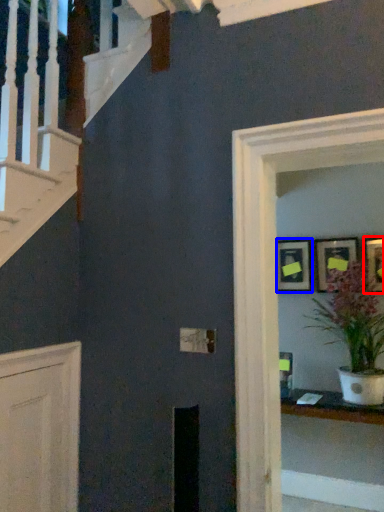
Question: Which point is further to the camera, picture frame (highlighted by a red box) or picture frame (highlighted by a blue box)?

Choices:
 (A) picture frame
 (B) picture frame

Answer: (B)